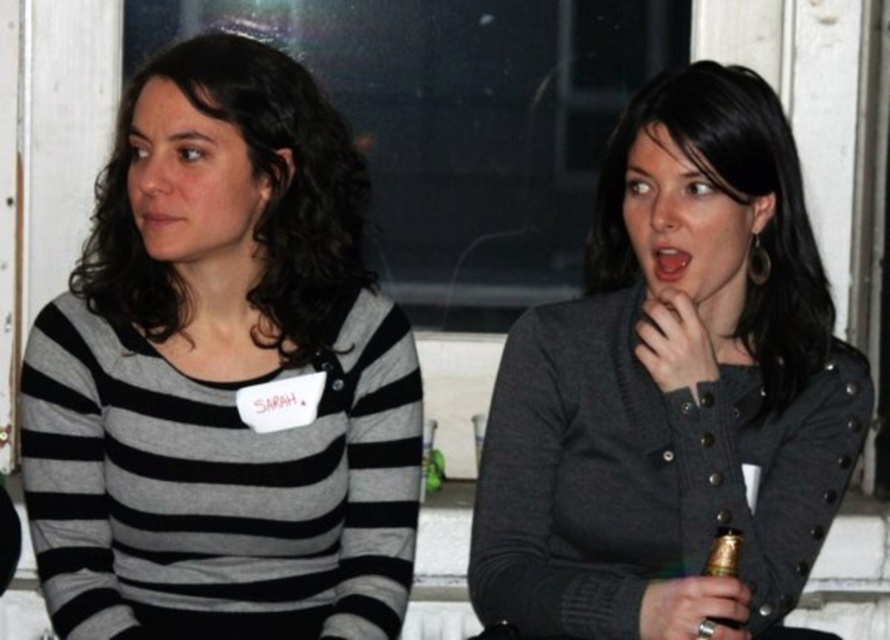
Question: Does striped cotton shirt at left appear on the right side of dark gray sweater at center?

Choices:
 (A) yes
 (B) no

Answer: (B)

Question: Is striped cotton shirt at left smaller than dark gray sweater at center?

Choices:
 (A) no
 (B) yes

Answer: (B)

Question: Among these points, which one is farthest from the camera?

Choices:
 (A) (640, 310)
 (B) (237, 208)

Answer: (A)

Question: Which point is closer to the camera taking this photo?

Choices:
 (A) (652, 337)
 (B) (356, 396)

Answer: (A)

Question: Does striped cotton shirt at left have a greater width compared to dark gray sweater at center?

Choices:
 (A) no
 (B) yes

Answer: (A)

Question: Which point is farther from the camera taking this photo?

Choices:
 (A) (79, 342)
 (B) (777, 326)

Answer: (B)